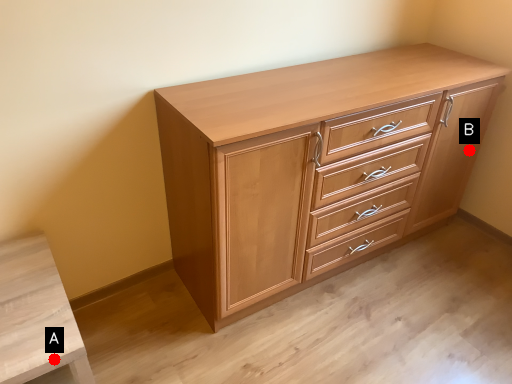
Question: Two points are circled on the image, labeled by A and B beside each circle. Which point is closer to the camera taking this photo?

Choices:
 (A) A is closer
 (B) B is closer

Answer: (A)